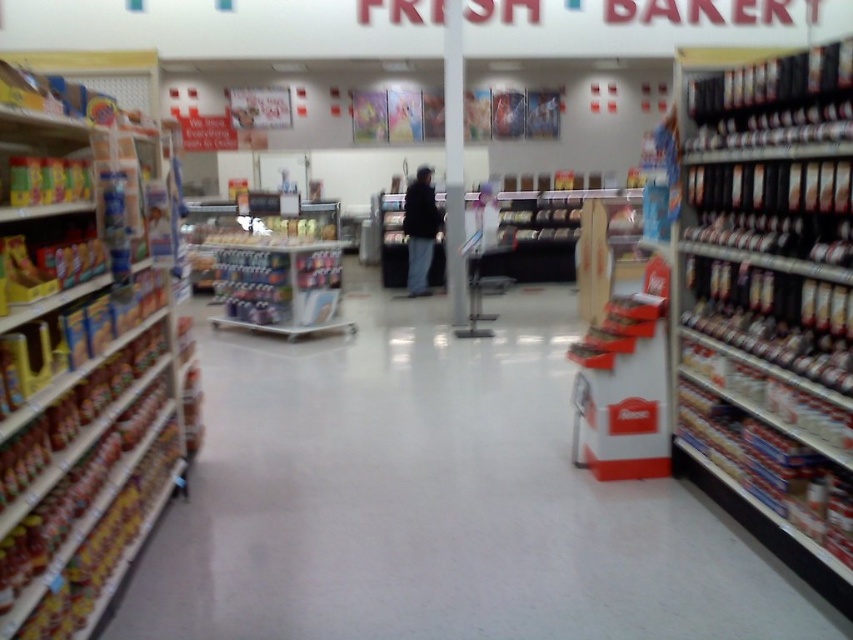
Question: In this image, where is matte cardboard shelf at left located relative to white glossy pillar at center?

Choices:
 (A) right
 (B) left

Answer: (B)

Question: Which is farther from the matte cardboard shelf at left?

Choices:
 (A) white glossy pillar at center
 (B) metallic silver cans at right

Answer: (A)

Question: Does matte cardboard shelf at left appear on the left side of white glossy pillar at center?

Choices:
 (A) no
 (B) yes

Answer: (B)

Question: Can you confirm if metallic silver cans at right is wider than black leather jacket at center?

Choices:
 (A) no
 (B) yes

Answer: (B)

Question: Which object appears farthest from the camera in this image?

Choices:
 (A) metallic silver cans at right
 (B) black leather jacket at center
 (C) white glossy pillar at center

Answer: (B)

Question: Which of the following is the closest to the observer?

Choices:
 (A) metallic silver cans at right
 (B) white glossy pillar at center
 (C) black leather jacket at center
 (D) matte cardboard shelf at left

Answer: (D)